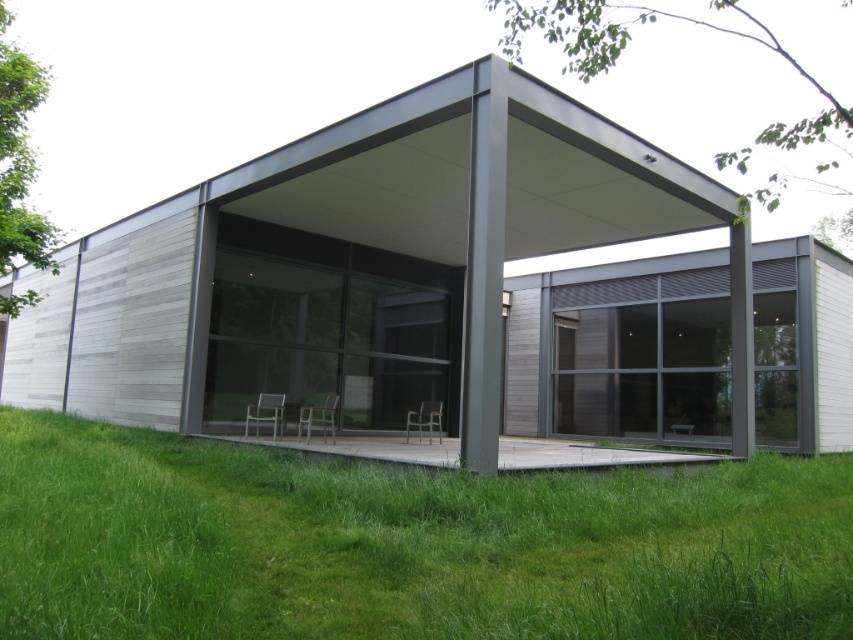
You are planning to install a small garden between the matte gray shelter at center and the green grass at lower center. If the garden requires a minimum of 20 feet of space between the two areas, will the current distance suffice?

The matte gray shelter at center is 18.66 feet from the green grass at lower center. Since 18.66 feet is less than the required 20 feet, the current distance is insufficient for the garden.

You are standing at the point marked as point (378, 269) in the image. What structure are you under?

The point (378, 269) corresponds to the matte gray shelter at center, so you are under the matte gray shelter at center.

You are planning to set up a picnic blanket on the green grass at lower center. Considering the position of the matte gray shelter at center, where should you place the blanket to avoid direct sunlight during the afternoon?

The matte gray shelter at center is positioned on the right side of green grass at lower center. To avoid direct sunlight, place the blanket under the shelter or on the left side of the green grass at lower center where the overhang might provide shade.